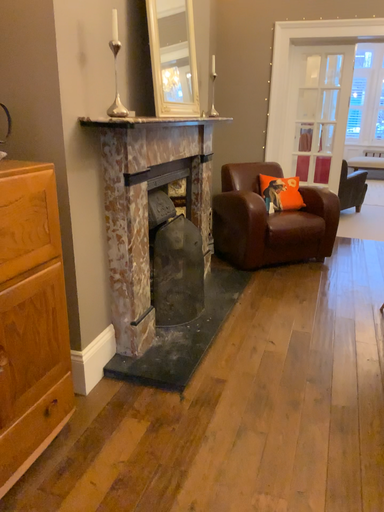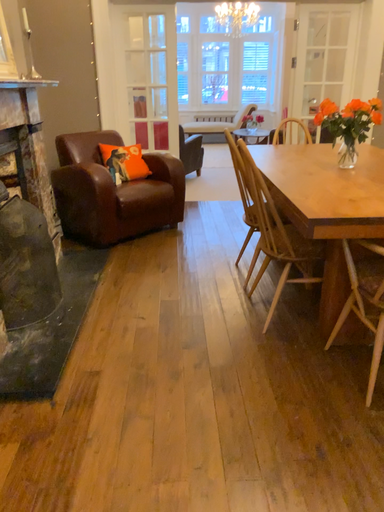
Question: How did the camera likely rotate when shooting the video?

Choices:
 (A) rotated right
 (B) rotated left

Answer: (A)